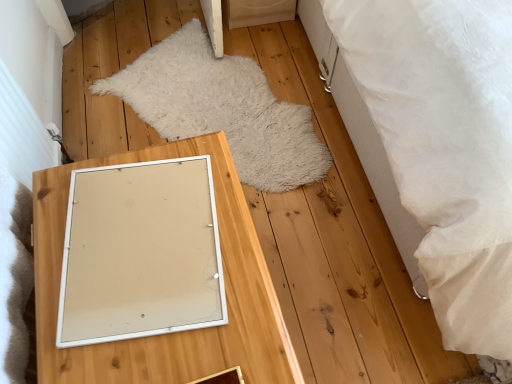
This screenshot has width=512, height=384. In order to click on free spot to the right of wooden mirror at center in this screenshot , I will do `click(339, 311)`.